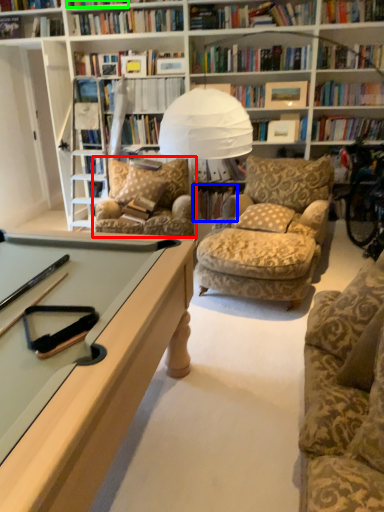
Question: Which is nearer to the chair (highlighted by a red box)? book (highlighted by a blue box) or book (highlighted by a green box).

Choices:
 (A) book
 (B) book

Answer: (A)